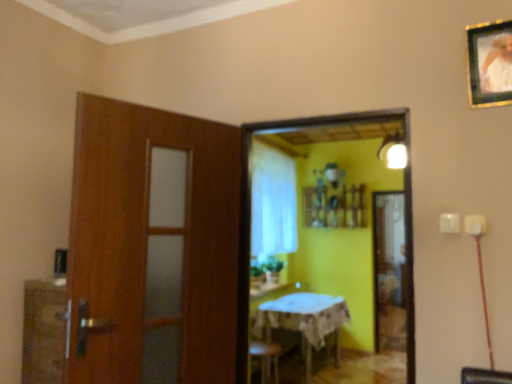
Question: Is wooden framed portrait at upper right wider or thinner than matte white light fixture at upper right?

Choices:
 (A) thin
 (B) wide

Answer: (A)

Question: Is wooden framed portrait at upper right taller or shorter than matte white light fixture at upper right?

Choices:
 (A) short
 (B) tall

Answer: (A)

Question: Which is nearer to the white sheer curtain at center?

Choices:
 (A) wooden framed portrait at upper right
 (B) wooden framed mirror at center
 (C) matte white light fixture at upper right
 (D) white cloth-covered table at center

Answer: (B)

Question: Which of these objects is positioned farthest from the wooden framed portrait at upper right?

Choices:
 (A) white cloth-covered table at center
 (B) matte white light fixture at upper right
 (C) white sheer curtain at center
 (D) wooden framed mirror at center

Answer: (D)